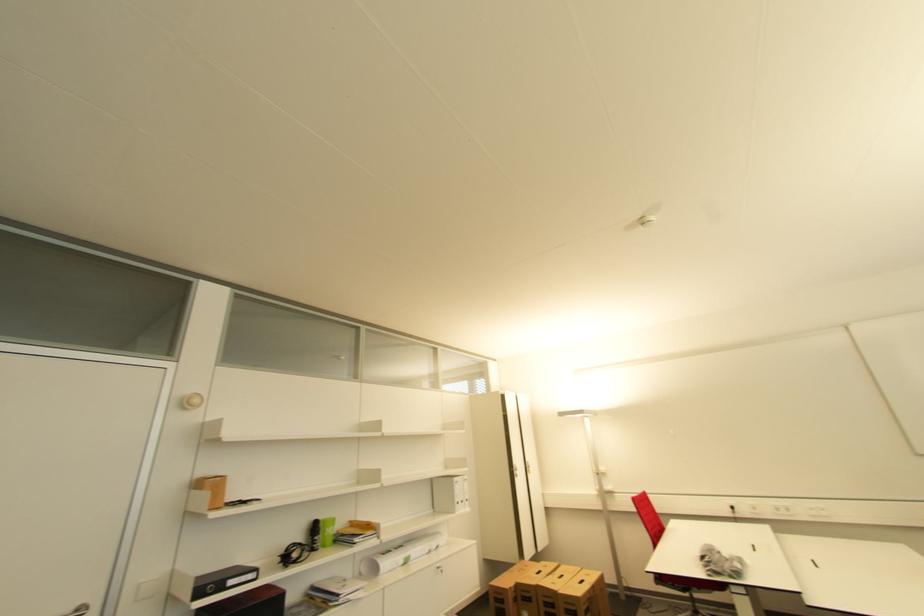
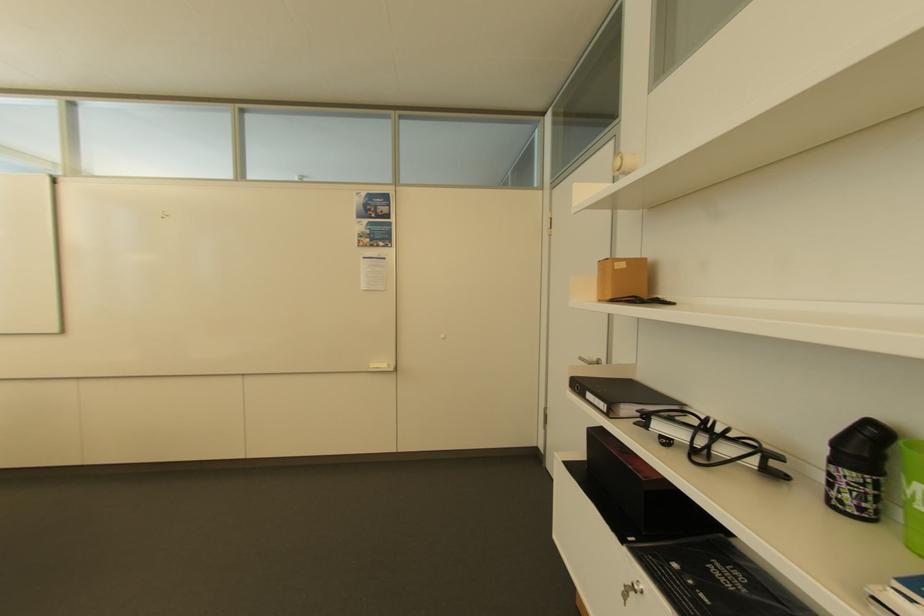
Find the pixel in the second image that matches the point at 334,533 in the first image.

(916, 493)